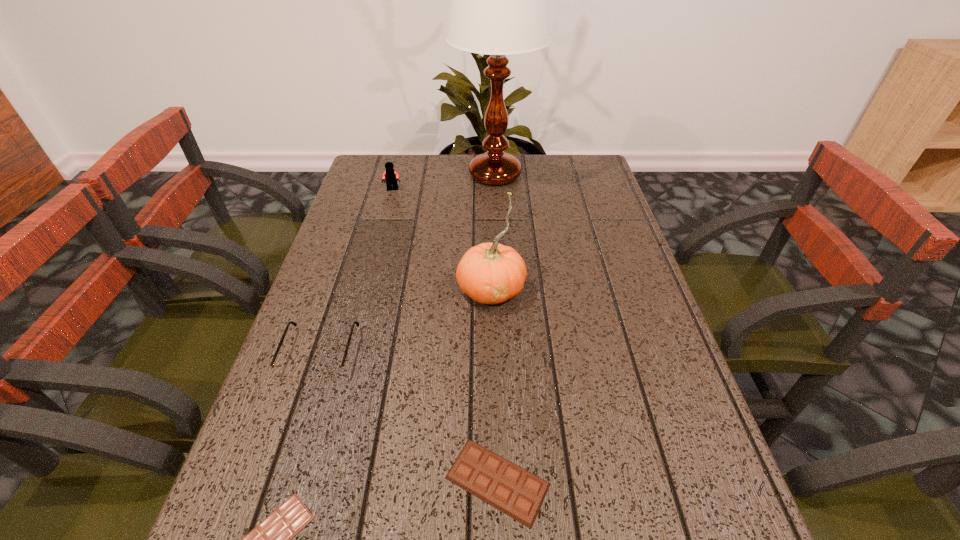
Identify the location of blank area in the image that satisfies the following two spatial constraints: 1. on the front-facing side of the fourth shortest object; 2. on the right side of the second tallest object. (366, 289).

Find the location of `free location that satisfies the following two spatial constraints: 1. on the front side of the fourth nearest object; 2. on the right side of the fifth tallest object`. free location that satisfies the following two spatial constraints: 1. on the front side of the fourth nearest object; 2. on the right side of the fifth tallest object is located at coordinates (496, 481).